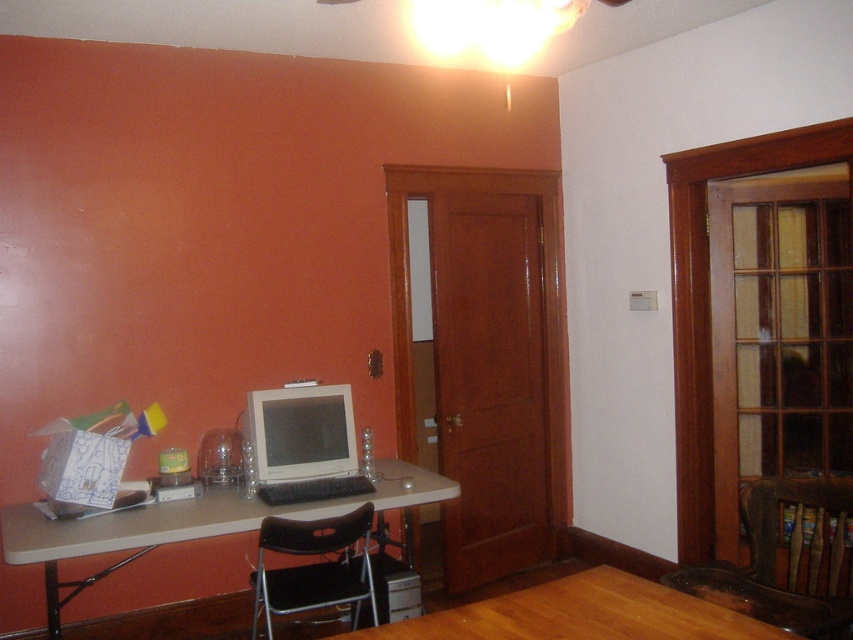
You are trying to decide whether to place a new lamp between the brown leather chair at lower right and the white glossy computer monitor at center. Based on their heights, which object should the lamp be placed closer to for stability?

The brown leather chair at lower right is much taller than the white glossy computer monitor at center. To ensure stability, the lamp should be placed closer to the brown leather chair at lower right since it has a higher base for support.

You are moving a white glossy computer monitor at center into a new room. The doorway is narrow, and you need to know if the brown leather chair at lower right can fit through the same doorway. Can it?

The brown leather chair at lower right is bigger than the white glossy computer monitor at center. Since the monitor can fit through the doorway, but the chair is larger, the brown leather chair at lower right might not fit through the same narrow doorway.